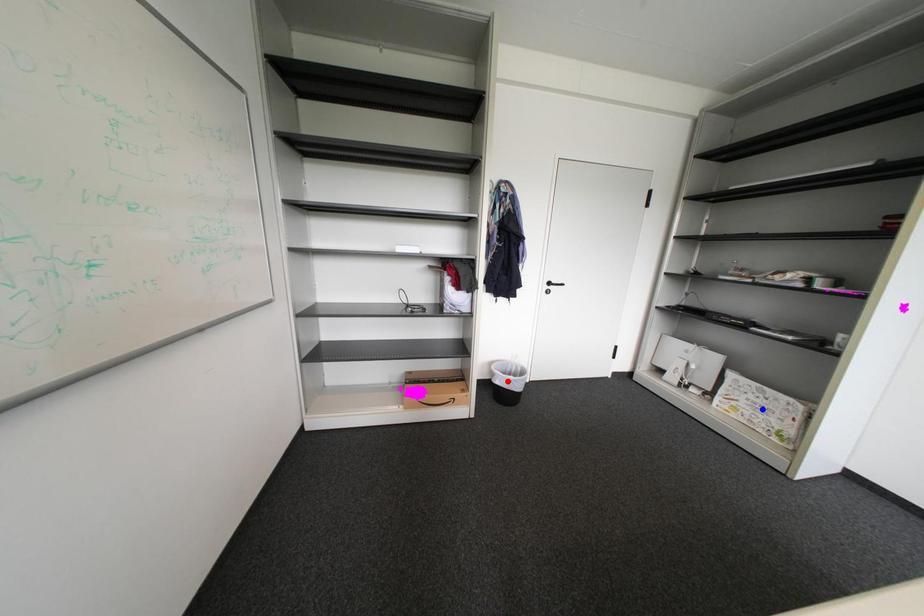
Question: Which of the two points in the image is closer to the camera?

Choices:
 (A) Blue point is closer.
 (B) Red point is closer.

Answer: (A)